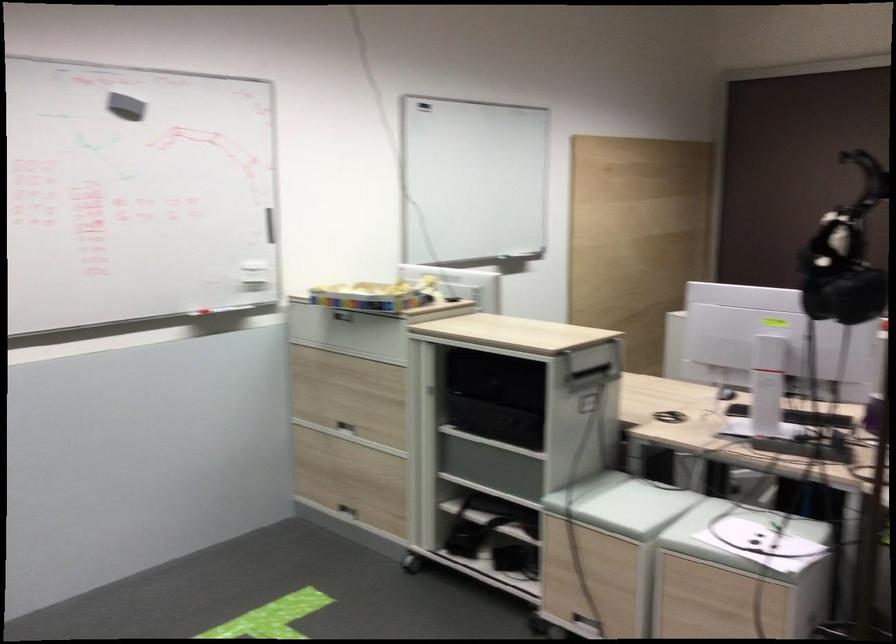
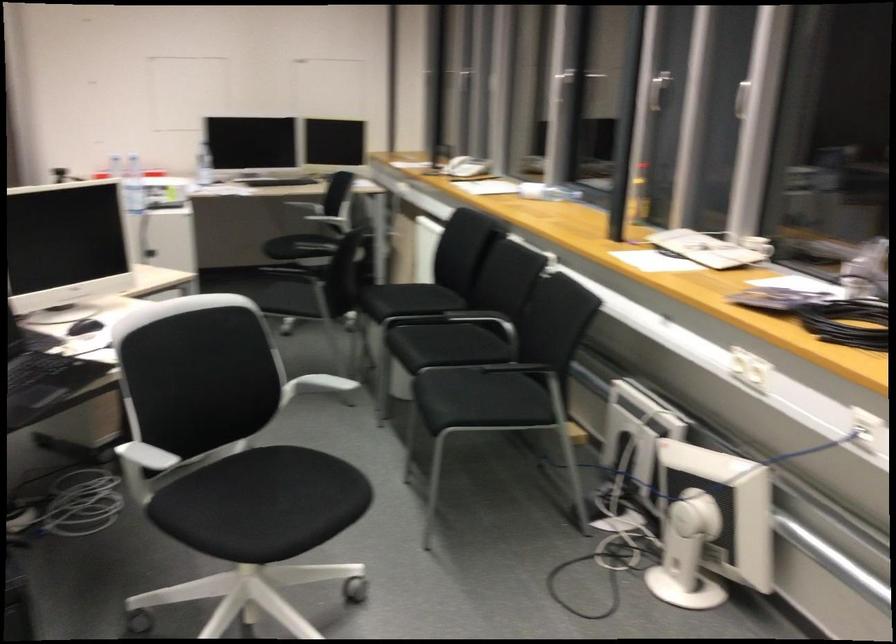
Question: The camera is either moving clockwise (left) or counter-clockwise (right) around the object. The first image is from the beginning of the video and the second image is from the end. Is the camera moving left or right when shooting the video?

Choices:
 (A) Left
 (B) Right

Answer: (A)